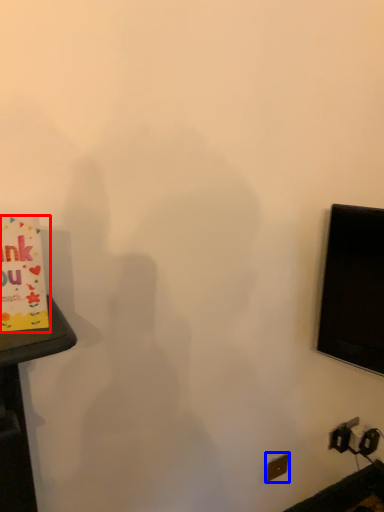
Question: Among these objects, which one is nearest to the camera, birthday card (highlighted by a red box) or electric outlet (highlighted by a blue box)?

Choices:
 (A) birthday card
 (B) electric outlet

Answer: (A)